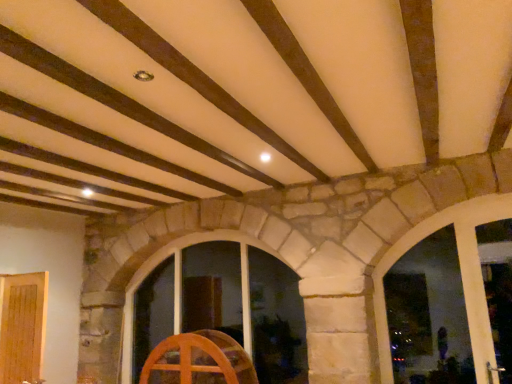
Question: Is wooden window at center, acting as the second window starting from the front, facing towards transparent glass window at center, which is counted as the second window, starting from the left?

Choices:
 (A) yes
 (B) no

Answer: (B)

Question: Is transparent glass window at center, marked as the 2th window in a back-to-front arrangement, at the back of wooden window at center, the 1th window positioned from the back?

Choices:
 (A) yes
 (B) no

Answer: (B)

Question: Is wooden window at center, acting as the second window starting from the front, shorter than transparent glass window at center, which is counted as the 1th window, starting from the front?

Choices:
 (A) no
 (B) yes

Answer: (A)

Question: Does wooden window at center, which is counted as the second window, starting from the right, have a greater width compared to transparent glass window at center, which is the 1th window from right to left?

Choices:
 (A) no
 (B) yes

Answer: (B)

Question: From the image's perspective, is wooden window at center, the 1th window positioned from the back, above transparent glass window at center, which is the 1th window from right to left?

Choices:
 (A) yes
 (B) no

Answer: (B)

Question: Would you say light brown wood door at lower left is to the left or to the right of transparent glass window at center, which is counted as the second window, starting from the left, in the picture?

Choices:
 (A) left
 (B) right

Answer: (A)

Question: Considering the positions of point (1, 337) and point (375, 322), is point (1, 337) closer or farther from the camera than point (375, 322)?

Choices:
 (A) closer
 (B) farther

Answer: (B)

Question: Is light brown wood door at lower left taller or shorter than transparent glass window at center, marked as the 2th window in a back-to-front arrangement?

Choices:
 (A) short
 (B) tall

Answer: (A)

Question: From a real-world perspective, is light brown wood door at lower left physically located above or below transparent glass window at center, which is counted as the 1th window, starting from the front?

Choices:
 (A) below
 (B) above

Answer: (A)

Question: Considering their positions, is transparent glass window at center, which is counted as the second window, starting from the left, located in front of or behind light brown wood door at lower left?

Choices:
 (A) behind
 (B) front

Answer: (B)

Question: Based on their positions, is transparent glass window at center, which is the 1th window from right to left, located to the left or right of light brown wood door at lower left?

Choices:
 (A) left
 (B) right

Answer: (B)

Question: From a real-world perspective, is transparent glass window at center, which is the 1th window from right to left, above or below light brown wood door at lower left?

Choices:
 (A) above
 (B) below

Answer: (A)

Question: From their relative heights in the image, would you say transparent glass window at center, marked as the 2th window in a back-to-front arrangement, is taller or shorter than light brown wood door at lower left?

Choices:
 (A) tall
 (B) short

Answer: (A)

Question: From the image's perspective, is wooden wheel at center positioned above or below wooden window at center, which is counted as the second window, starting from the right?

Choices:
 (A) above
 (B) below

Answer: (B)

Question: From a real-world perspective, is wooden wheel at center above or below wooden window at center, the 1th window positioned from the back?

Choices:
 (A) above
 (B) below

Answer: (B)